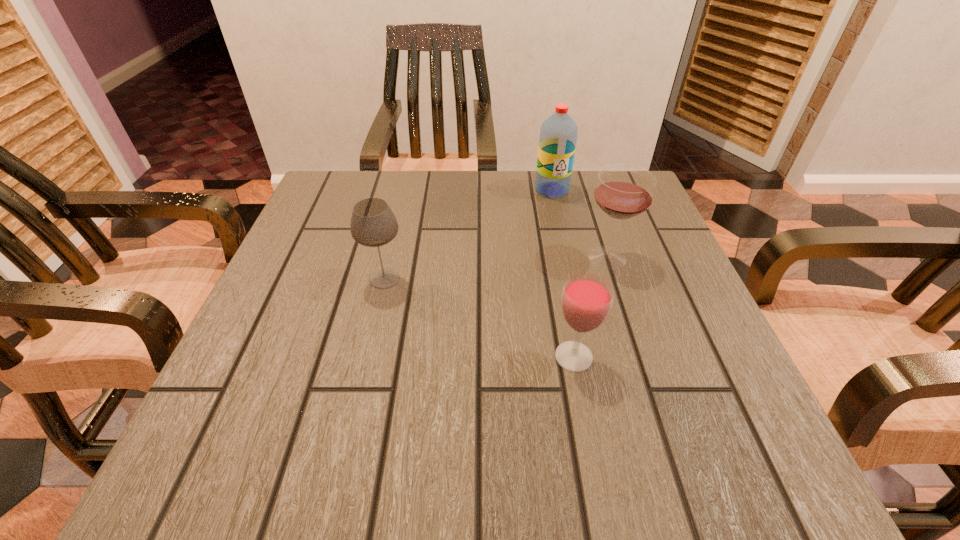
Where is `wineglass object that ranks as the second closest to the second wineglass from left to right`? The image size is (960, 540). wineglass object that ranks as the second closest to the second wineglass from left to right is located at coordinates (373, 224).

Point out which wineglass is positioned as the second nearest to the leftmost wineglass. Please provide its 2D coordinates. Your answer should be formatted as a tuple, i.e. [(x, y)], where the tuple contains the x and y coordinates of a point satisfying the conditions above.

[(624, 191)]

This screenshot has height=540, width=960. In order to click on free region that satisfies the following two spatial constraints: 1. on the front label of the rightmost wineglass; 2. on the right side of the water bottle in this screenshot , I will do `click(566, 258)`.

Identify the location of free space in the image that satisfies the following two spatial constraints: 1. on the back side of the rightmost wineglass; 2. on the right side of the nearest wineglass. (555, 258).

Identify the location of vacant space that satisfies the following two spatial constraints: 1. on the front label of the farthest object; 2. on the left side of the rightmost wineglass. The width and height of the screenshot is (960, 540). (566, 258).

Where is `free space that satisfies the following two spatial constraints: 1. on the front label of the rightmost wineglass; 2. on the right side of the water bottle`? This screenshot has height=540, width=960. free space that satisfies the following two spatial constraints: 1. on the front label of the rightmost wineglass; 2. on the right side of the water bottle is located at coordinates (566, 258).

Locate an element on the screen. free point that satisfies the following two spatial constraints: 1. on the front side of the leftmost object; 2. on the left side of the nearest wineglass is located at coordinates (367, 356).